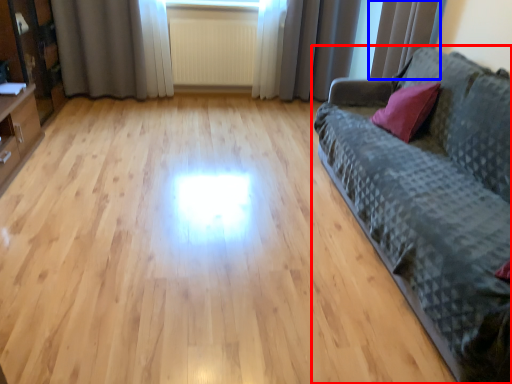
Question: Which of the following is the closest to the observer, studio couch (highlighted by a red box) or curtain (highlighted by a blue box)?

Choices:
 (A) studio couch
 (B) curtain

Answer: (A)